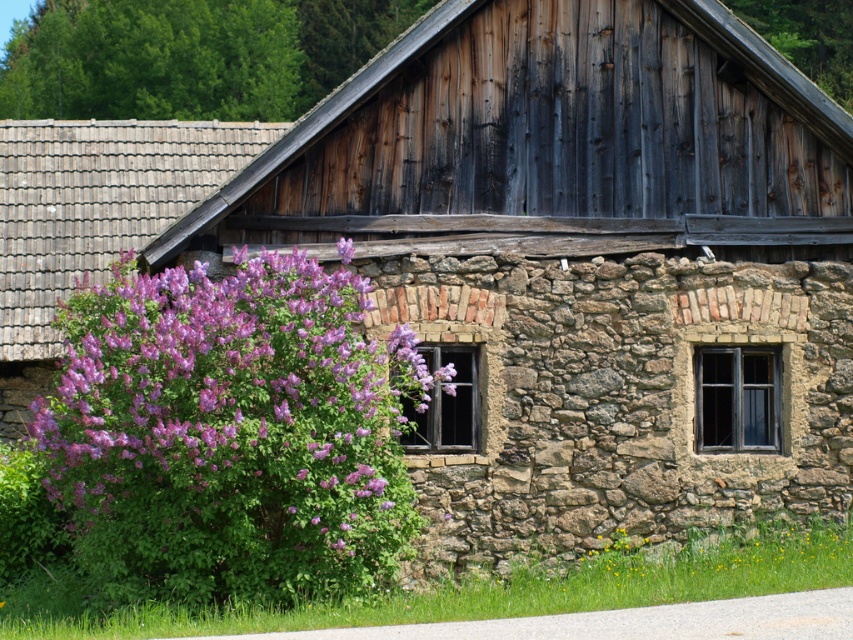
Does purple leafy bush at left appear on the left side of purple leafy bush at upper center?

Yes, purple leafy bush at left is to the left of purple leafy bush at upper center.

Consider the image. Who is more forward, (350, 456) or (793, 45)?

Point (350, 456) is more forward.

This screenshot has width=853, height=640. What do you see at coordinates (231, 420) in the screenshot?
I see `purple leafy bush at left` at bounding box center [231, 420].

Identify the location of purple leafy bush at left. The width and height of the screenshot is (853, 640). (231, 420).

Is green leafy tree at upper left closer to camera compared to purple leafy bush at upper center?

No, green leafy tree at upper left is further to the viewer.

Does green leafy tree at upper left appear on the left side of purple leafy bush at upper center?

Yes, green leafy tree at upper left is to the left of purple leafy bush at upper center.

Which is in front, point (170, 4) or point (810, 74)?

Positioned in front is point (810, 74).

The width and height of the screenshot is (853, 640). What are the coordinates of `green leafy tree at upper left` in the screenshot? It's located at click(190, 54).

Between purple leafy bush at left and green leafy tree at upper left, which one is positioned lower?

purple leafy bush at left

Between purple leafy bush at left and green leafy tree at upper left, which one is positioned higher?

Positioned higher is green leafy tree at upper left.

Does point (358, 429) come closer to viewer compared to point (196, 8)?

Yes, it is in front of point (196, 8).

Locate an element on the screen. purple leafy bush at left is located at coordinates (231, 420).